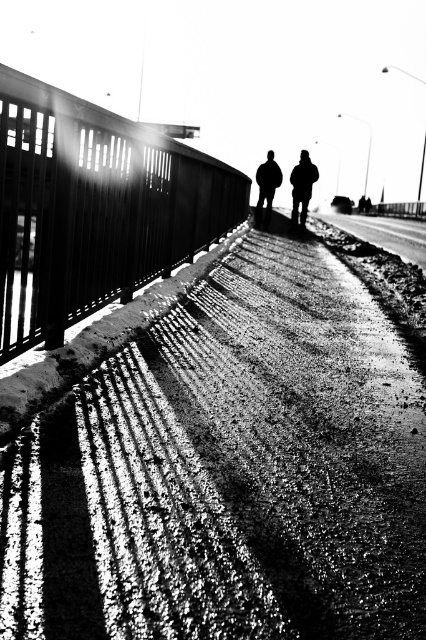
Can you confirm if rough asphalt at center is positioned below dark fabric jacket at center?

Correct, rough asphalt at center is located below dark fabric jacket at center.

Is rough asphalt at center smaller than dark fabric jacket at center?

Yes, rough asphalt at center is smaller than dark fabric jacket at center.

Is point (365, 508) in front of point (270, 212)?

Yes, it is in front of point (270, 212).

Image resolution: width=426 pixels, height=640 pixels. Find the location of `rough asphalt at center`. rough asphalt at center is located at coordinates (229, 472).

From the picture: Between dark textured jacket at center and dark fabric jacket at center, which one is positioned lower?

dark textured jacket at center

Who is more forward, (304, 212) or (264, 220)?

Point (304, 212) is in front.

Between point (310, 188) and point (276, 180), which one is positioned in front?

Point (310, 188)

The image size is (426, 640). I want to click on dark textured jacket at center, so click(302, 188).

Consider the image. Does rough asphalt at center have a lesser height compared to dark textured jacket at center?

Yes.

Does rough asphalt at center have a larger size compared to dark textured jacket at center?

Actually, rough asphalt at center might be smaller than dark textured jacket at center.

This screenshot has width=426, height=640. What are the coordinates of `rough asphalt at center` in the screenshot? It's located at (229, 472).